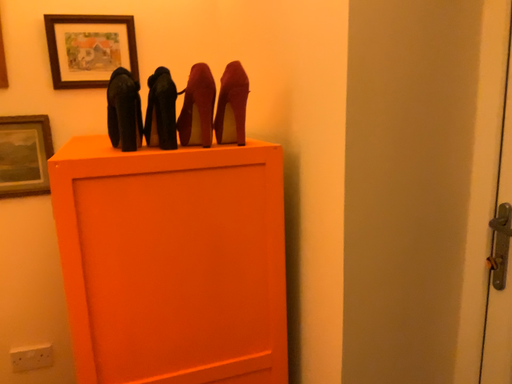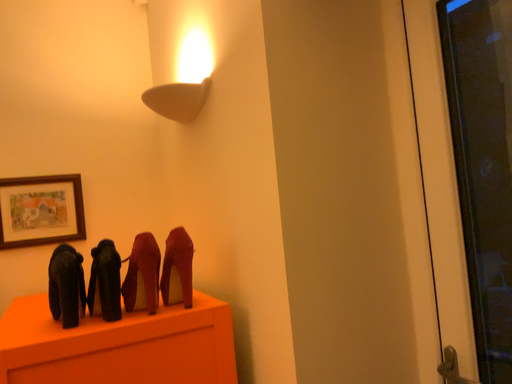
Question: How did the camera likely rotate when shooting the video?

Choices:
 (A) rotated upward
 (B) rotated downward

Answer: (A)